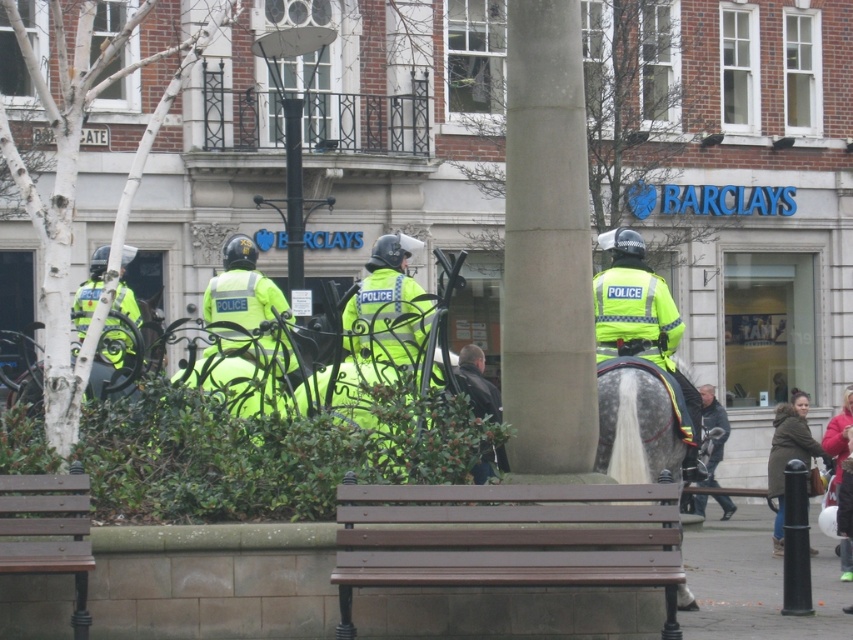
Question: Is concrete at center below gray glossy horse at center?

Choices:
 (A) no
 (B) yes

Answer: (A)

Question: Does dark brown leather jacket at lower right have a greater width compared to red fabric coat at lower right?

Choices:
 (A) no
 (B) yes

Answer: (B)

Question: Does neon yellow jacket at center lie behind dark brown leather jacket at center?

Choices:
 (A) yes
 (B) no

Answer: (A)

Question: Which is farther from the concrete at center?

Choices:
 (A) fluorescent yellow jacket at center
 (B) wooden bench at lower left

Answer: (A)

Question: Which point is closer to the camera?

Choices:
 (A) (573, 67)
 (B) (851, 465)
 (C) (527, 580)
 (D) (467, 356)

Answer: (C)

Question: Which point is farther from the camera taking this photo?

Choices:
 (A) (477, 384)
 (B) (238, 284)
 (C) (91, 264)

Answer: (C)